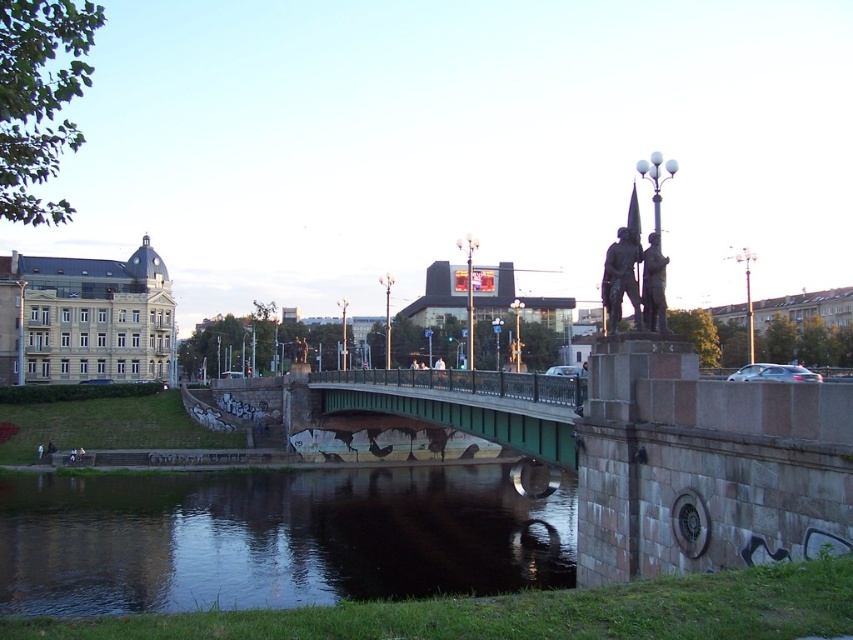
Question: Is green painted metal bridge at center above bronze statue at upper right?

Choices:
 (A) no
 (B) yes

Answer: (A)

Question: Which object is closer to the camera taking this photo?

Choices:
 (A) dark reflective water at center
 (B) bronze statue at upper right

Answer: (B)

Question: Estimate the real-world distances between objects in this image. Which object is closer to the dark reflective water at center?

Choices:
 (A) green painted metal bridge at center
 (B) bronze statue at upper right
 (C) bronze statue at center

Answer: (A)

Question: Is green painted metal bridge at center smaller than bronze statue at upper right?

Choices:
 (A) no
 (B) yes

Answer: (A)

Question: Which object is positioned farthest from the green painted metal bridge at center?

Choices:
 (A) dark reflective water at center
 (B) bronze statue at center

Answer: (B)

Question: Does bronze statue at center appear on the left side of bronze statue at upper right?

Choices:
 (A) no
 (B) yes

Answer: (B)